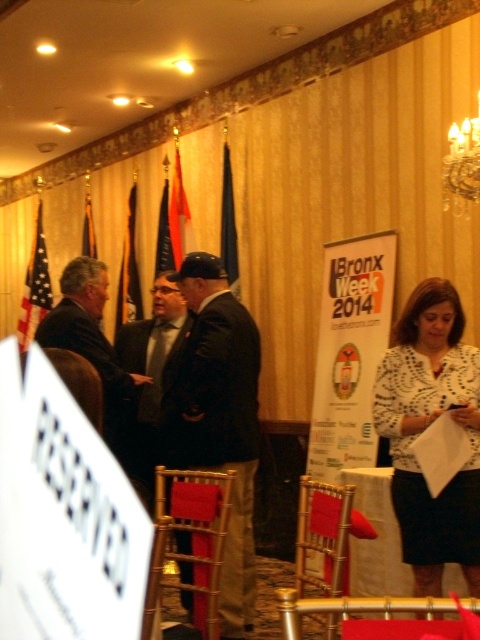
Between dark brown leather jacket at center and red fabric flag at upper center, which one appears on the left side from the viewer's perspective?

red fabric flag at upper center is more to the left.

Locate an element on the screen. Image resolution: width=480 pixels, height=640 pixels. dark brown leather jacket at center is located at coordinates (217, 417).

Can you confirm if american flag at left is positioned to the right of blue fabric flag at upper center?

In fact, american flag at left is to the left of blue fabric flag at upper center.

Between point (32, 304) and point (230, 225), which one is positioned behind?

The point (32, 304) is more distant.

Find the location of `american flag at left`. american flag at left is located at coordinates (35, 285).

Who is more distant from viewer, (309, 515) or (237, 294)?

Point (237, 294)

The image size is (480, 640). What do you see at coordinates (324, 536) in the screenshot? I see `gold metallic chair at center` at bounding box center [324, 536].

The height and width of the screenshot is (640, 480). Describe the element at coordinates (324, 536) in the screenshot. I see `gold metallic chair at center` at that location.

The width and height of the screenshot is (480, 640). I want to click on gold metallic chair at center, so click(x=324, y=536).